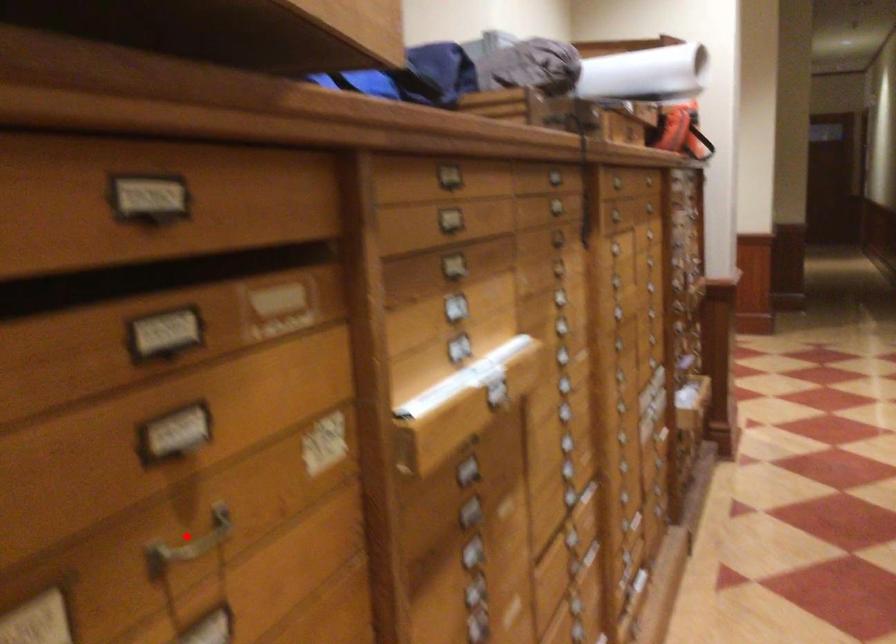
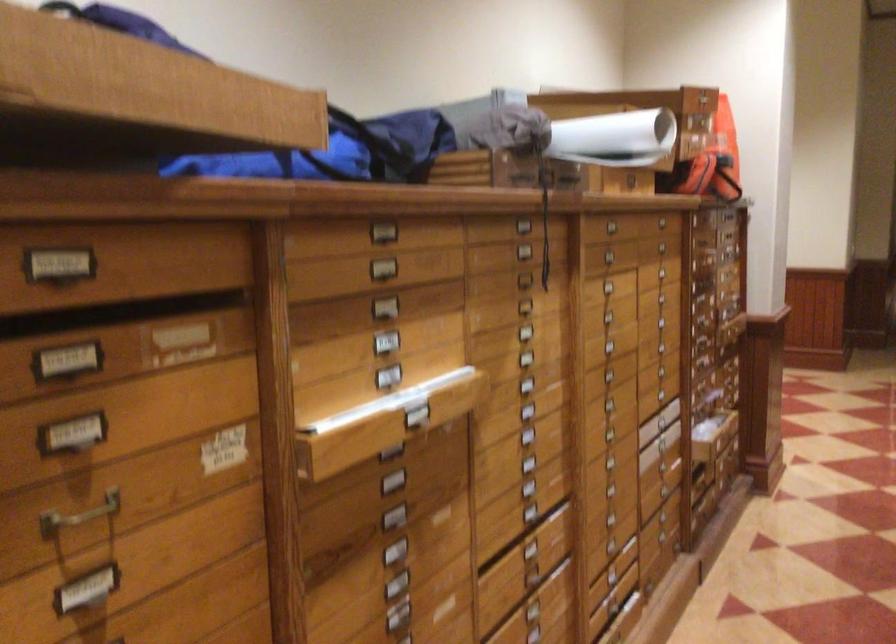
Locate, in the second image, the point that corresponds to the highlighted location in the first image.

(79, 515)